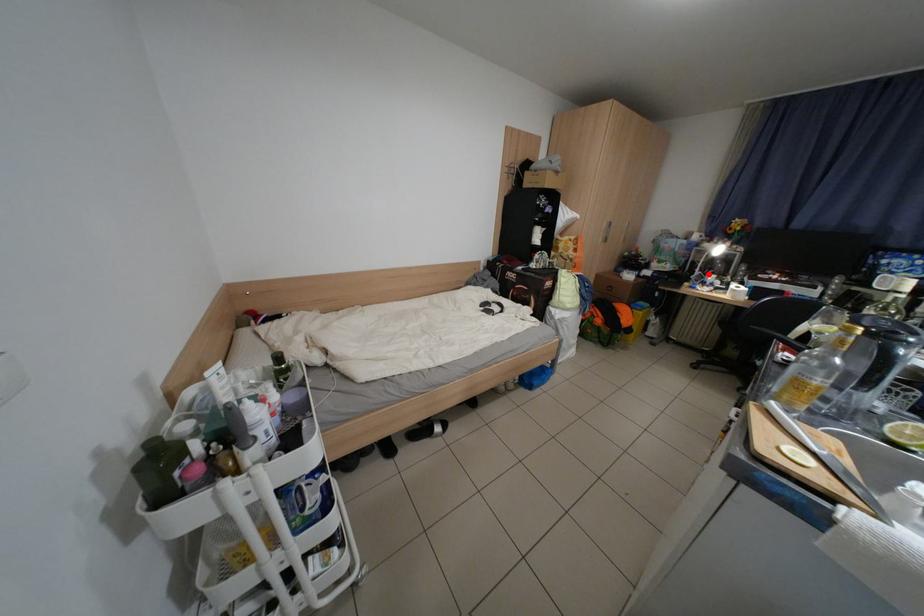
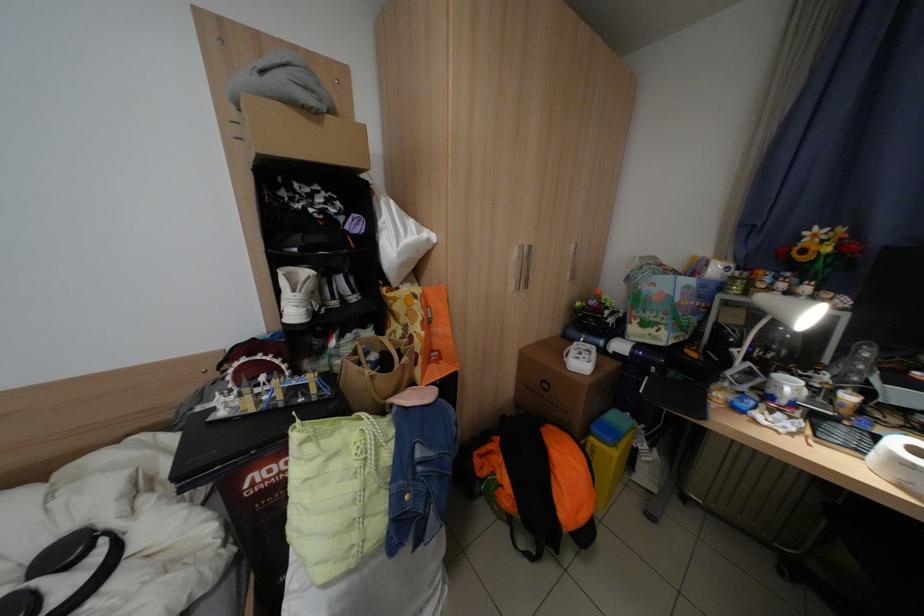
Find the pixel in the second image that matches the highlighted location in the first image.

(752, 366)